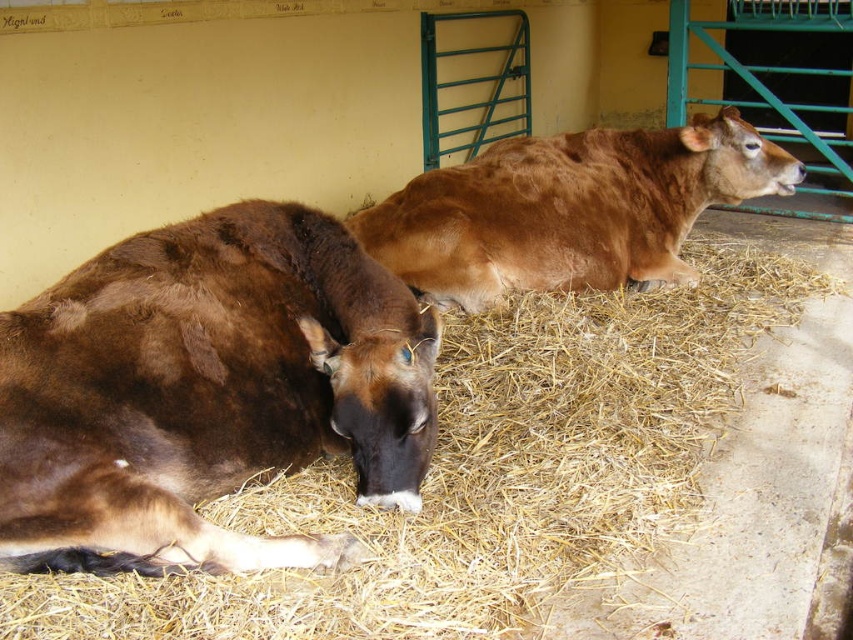
You are a farmer checking the barn. You see the brown matte cow at lower left and the brown smooth cow at center. Which cow is closer to the left side of the barn?

The brown matte cow at lower left is positioned on the left side of the brown smooth cow at center, so it is closer to the left side of the barn.

From the picture: You are standing in the barn looking at the two cows. There are two points marked in the image. Point A is at coordinates point (604, 388) and Point B is at coordinates point (486, 288). Which point is closer to you?

Point A at point (604, 388) is closer to the camera than point B at point (486, 288).